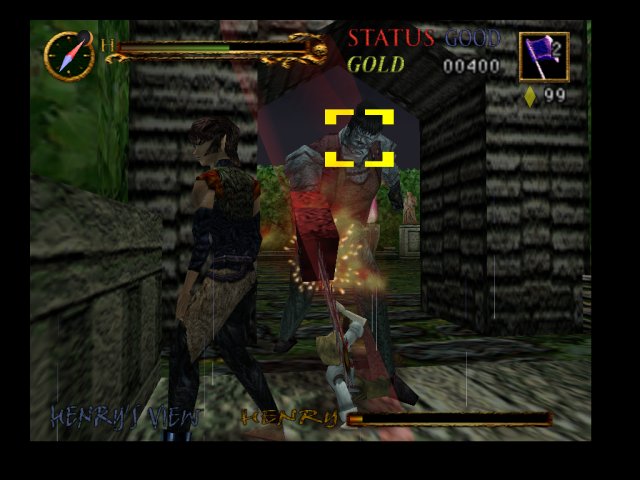
You are a GUI agent. You are given a task and a screenshot of the screen. Output one action in this format:
    pyautogui.click(x=<x>, y=<y>)
    Task: Click on the bar
    This screenshot has width=640, height=480.
    Given the screenshot: What is the action you would take?
    pyautogui.click(x=371, y=418)